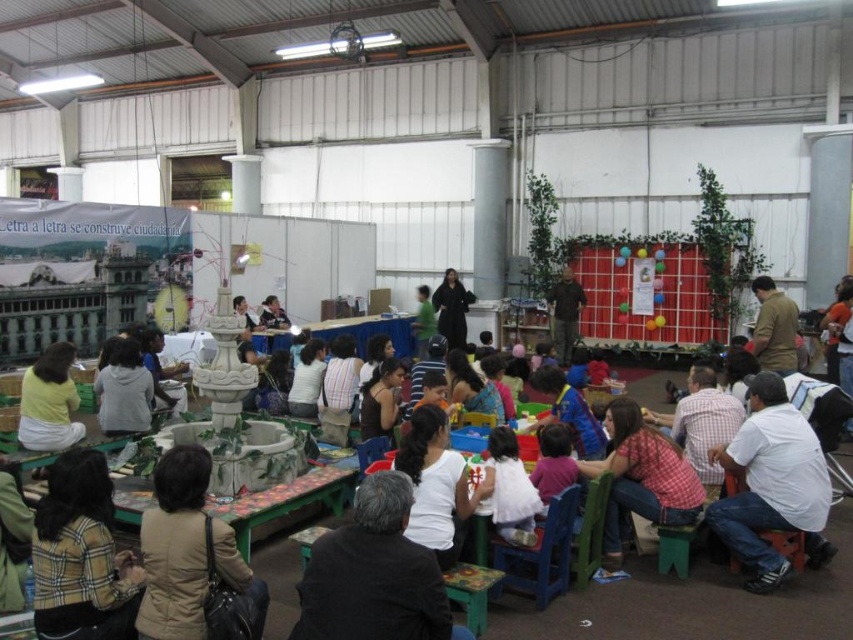
You are standing at point [178,364] and want to walk towards the fountain in the central area. Is the point [67,445] located in front of you or behind you?

Point [67,445] is in front of point [178,364], so it is located in front of you.

You are standing in the hall and want to take a photo of both point (108, 506) and point (445, 296) in the image. Since you want both points to be in focus, which point should you focus on to ensure both are sharp?

You should focus on point (445, 296) because it is farther from the camera than point (108, 506). By focusing on the farther point, the closer point will also be within the depth of field, ensuring both are sharp.

From the picture: You are organizing a clothing donation drive and need to pack items into boxes. You have a plaid fabric jacket at lower left and a black matte dress at center. Which item can you fit into a narrow box that is only 10 cm thick?

The plaid fabric jacket at lower left is thinner than the black matte dress at center, so it can fit into the narrow box that is 10 cm thick.